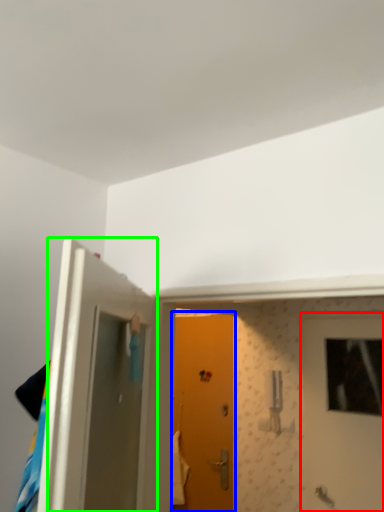
Question: Estimate the real-world distances between objects in this image. Which object is farther from door (highlighted by a red box), door (highlighted by a blue box) or door (highlighted by a green box)?

Choices:
 (A) door
 (B) door

Answer: (B)